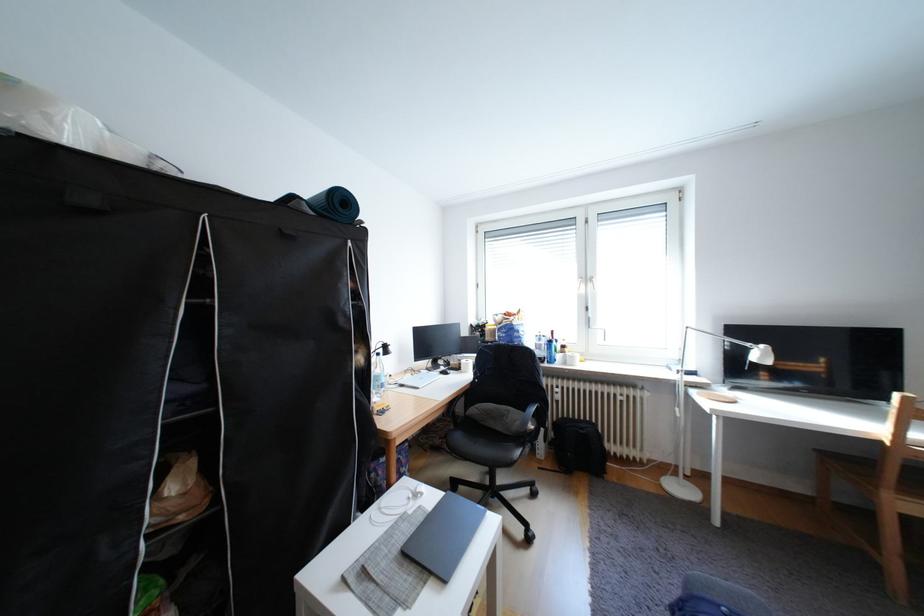
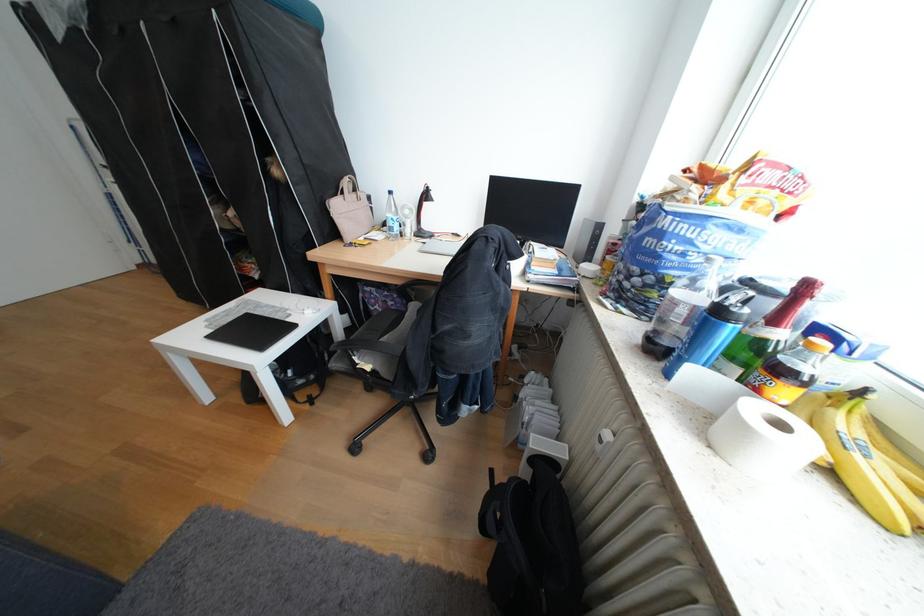
Where in the second image is the point corresponding to pixel 565 333 from the first image?

(819, 288)